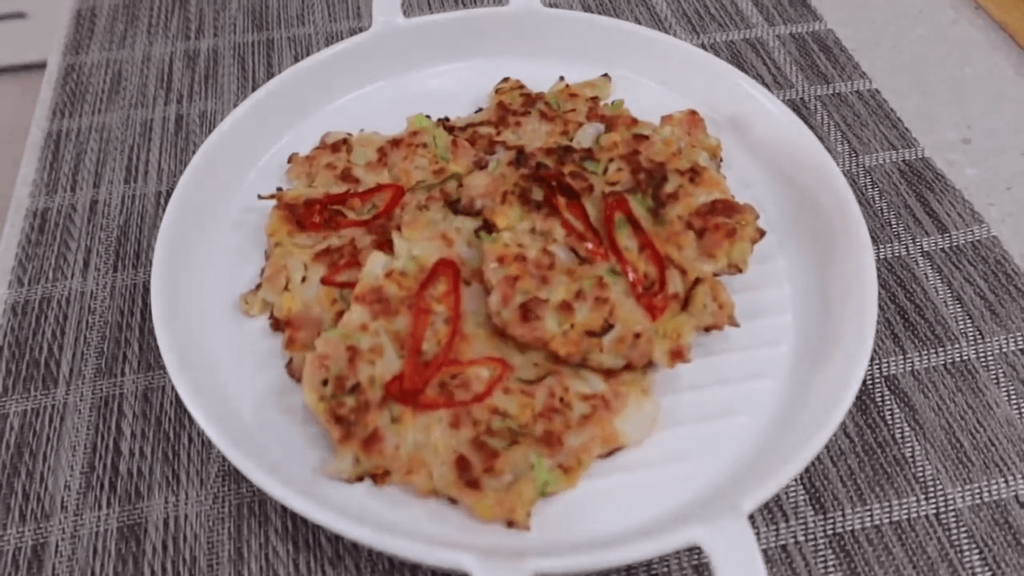
Locate an element on the screen. The image size is (1024, 576). placemats is located at coordinates (155, 64), (934, 227).